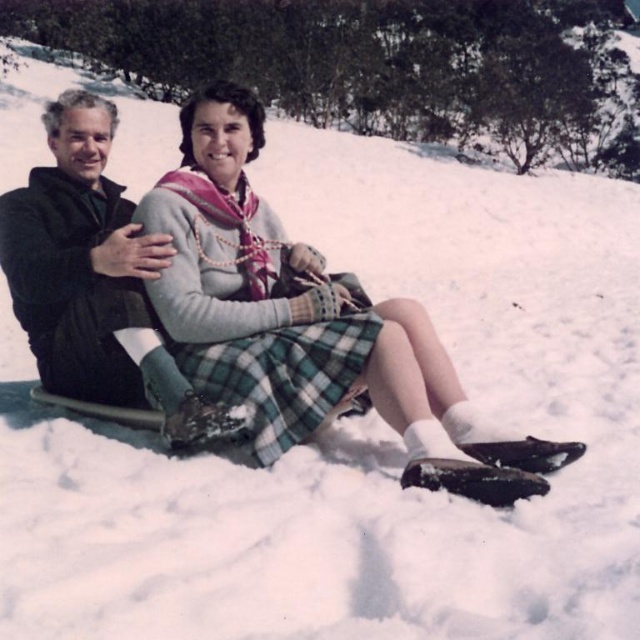
Question: Which point is farther from the camera taking this photo?

Choices:
 (A) (257, 413)
 (B) (36, 339)

Answer: (B)

Question: Which of the following is the farthest from the observer?

Choices:
 (A) (230, 420)
 (B) (298, 392)

Answer: (B)

Question: Is green plaid skirt at center further to the viewer compared to black matte jacket at left?

Choices:
 (A) yes
 (B) no

Answer: (B)

Question: Is green plaid skirt at center above black matte jacket at left?

Choices:
 (A) yes
 (B) no

Answer: (B)

Question: From the image, what is the correct spatial relationship of green plaid skirt at center in relation to black matte jacket at left?

Choices:
 (A) left
 (B) right

Answer: (B)